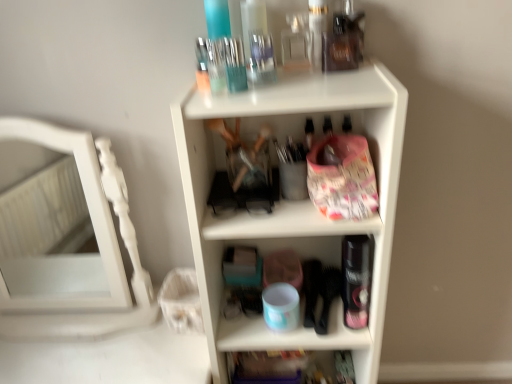
Question: In terms of width, does white plastic shelf at center, which is counted as the second shelf, starting from the bottom, look wider or thinner when compared to translucent plastic container at lower center, positioned as the 1th shelf in bottom-to-top order?

Choices:
 (A) wide
 (B) thin

Answer: (A)

Question: In terms of size, does white plastic shelf at center, which is counted as the second shelf, starting from the bottom, appear bigger or smaller than translucent plastic container at lower center, positioned as the 1th shelf in bottom-to-top order?

Choices:
 (A) big
 (B) small

Answer: (A)

Question: Which of these objects is positioned closest to the white wooden mirror at left?

Choices:
 (A) white plastic shelf at center, the first shelf from the top
 (B) translucent plastic container at lower center, the second shelf when ordered from top to bottom

Answer: (A)

Question: Which of these objects is positioned closest to the white plastic shelf at center, which is counted as the second shelf, starting from the bottom?

Choices:
 (A) translucent plastic container at lower center, positioned as the 1th shelf in bottom-to-top order
 (B) white wooden mirror at left

Answer: (A)